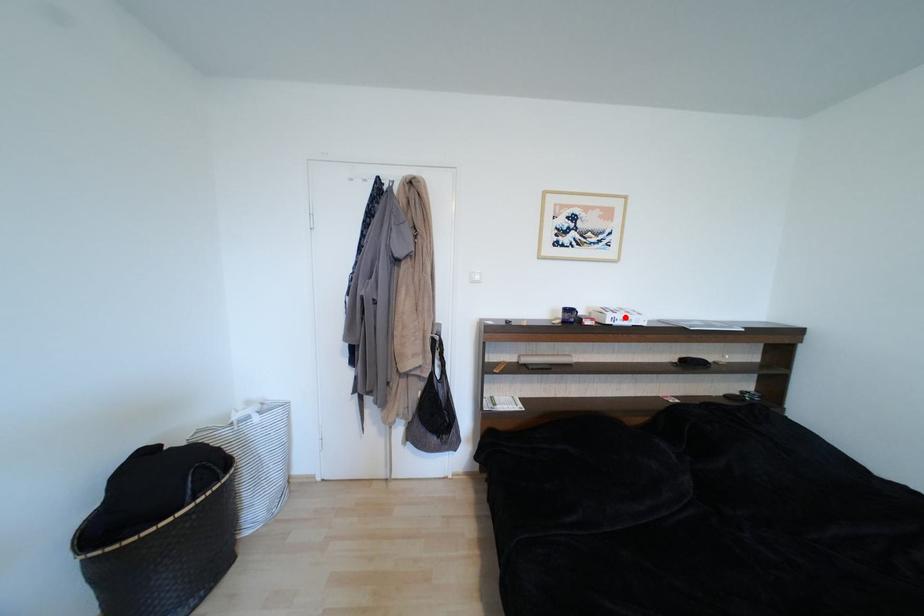
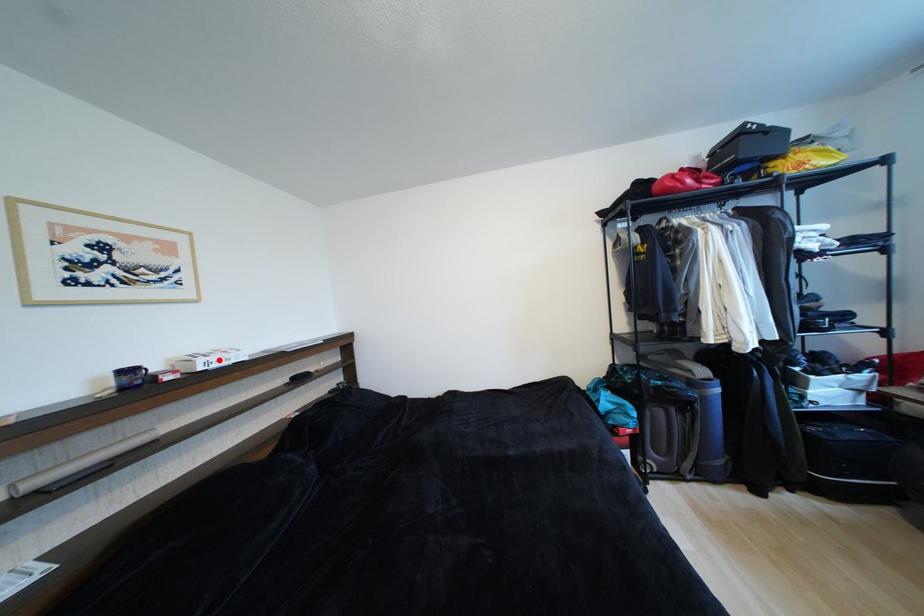
I am providing you with two images of the same scene from different viewpoints. A red point is marked on the first image and another point is marked on the second image. Are the points marked in image1 and image2 representing the same 3D position?

Yes